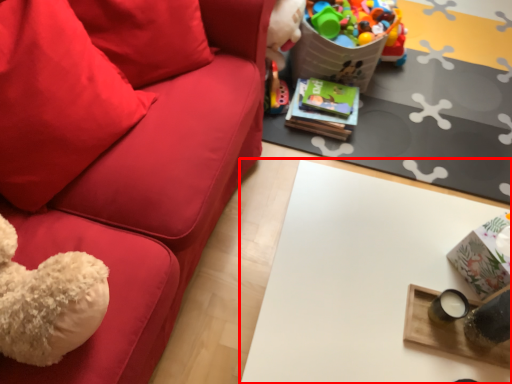
Question: From the image's perspective, where is table (annotated by the red box) located relative to pillow?

Choices:
 (A) below
 (B) above

Answer: (A)